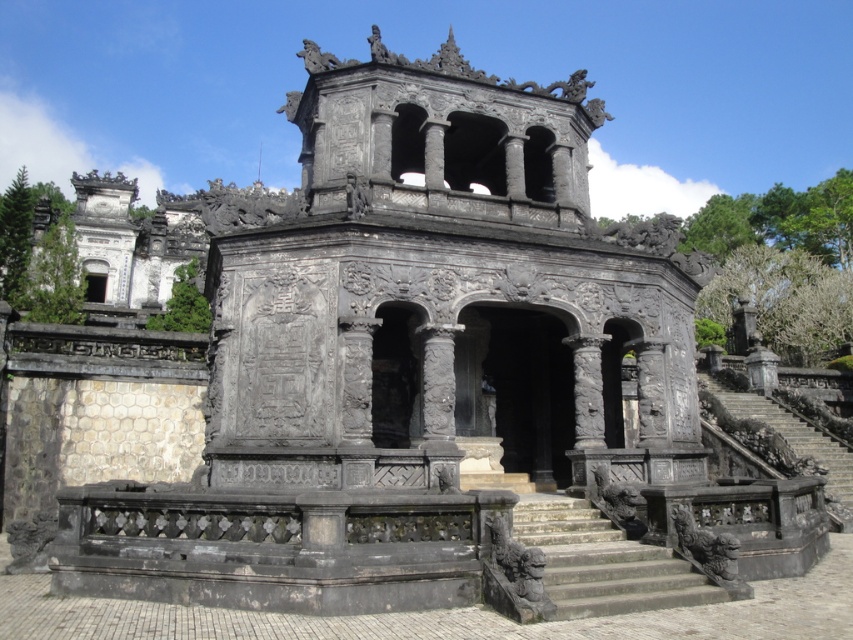
Question: Which point is farther to the camera?

Choices:
 (A) (788, 428)
 (B) (567, 522)

Answer: (A)

Question: Which of the following is the closest to the observer?

Choices:
 (A) stone stairs at center
 (B) dark gray stone stairs at lower right

Answer: (A)

Question: Does stone stairs at center appear over dark gray stone stairs at lower right?

Choices:
 (A) no
 (B) yes

Answer: (B)

Question: Does stone stairs at center have a smaller size compared to dark gray stone stairs at lower right?

Choices:
 (A) no
 (B) yes

Answer: (B)

Question: Which of the following is the farthest from the observer?

Choices:
 (A) (769, 429)
 (B) (584, 588)

Answer: (A)

Question: Does stone stairs at center appear under dark gray stone stairs at lower right?

Choices:
 (A) no
 (B) yes

Answer: (A)